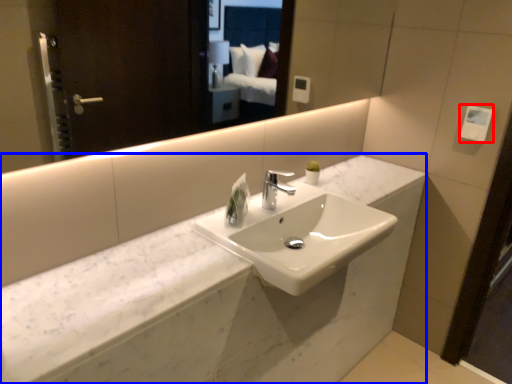
Question: Which object appears closest to the camera in this image, hand dryer (highlighted by a red box) or counter (highlighted by a blue box)?

Choices:
 (A) hand dryer
 (B) counter

Answer: (B)